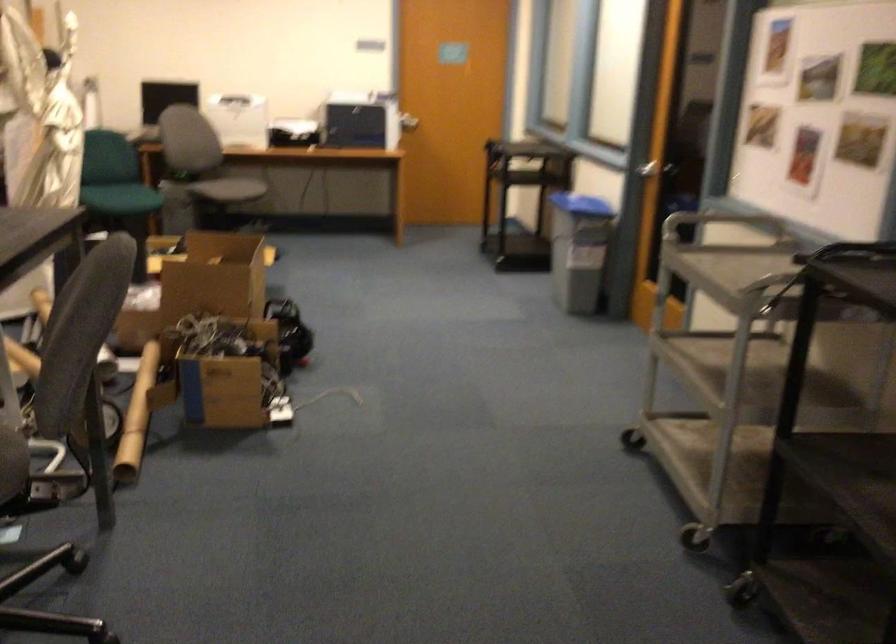
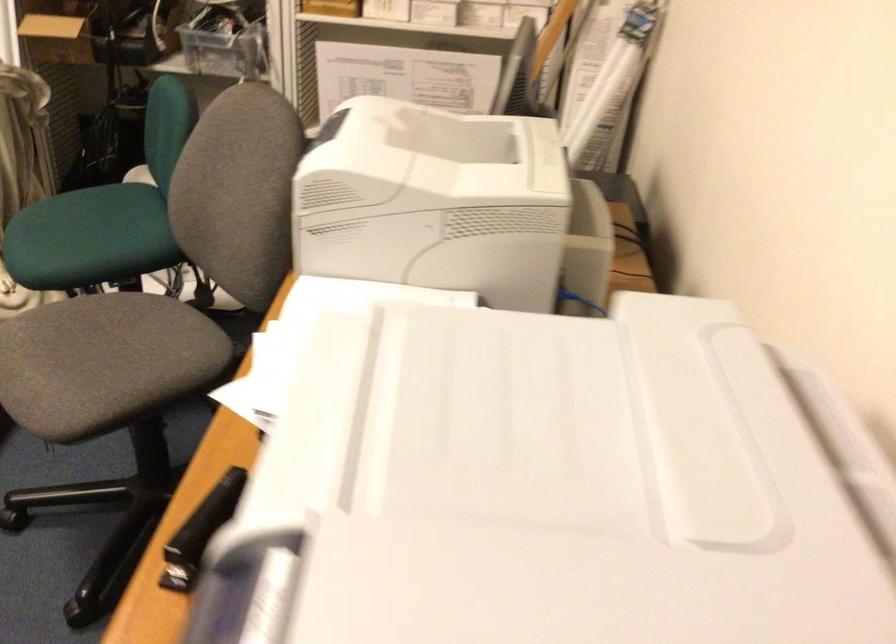
Locate, in the second image, the point that corresponds to the point at 367,86 in the first image.

(593, 491)